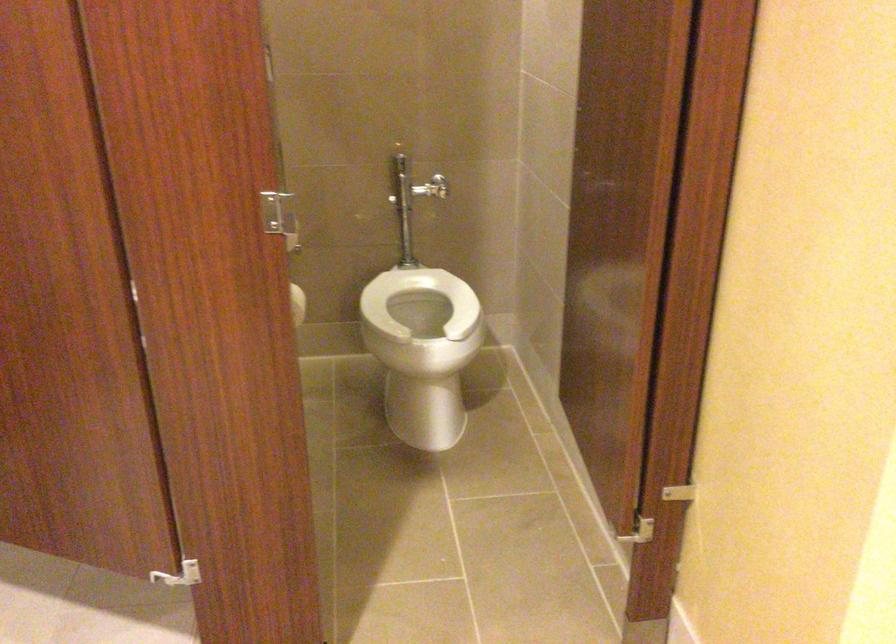
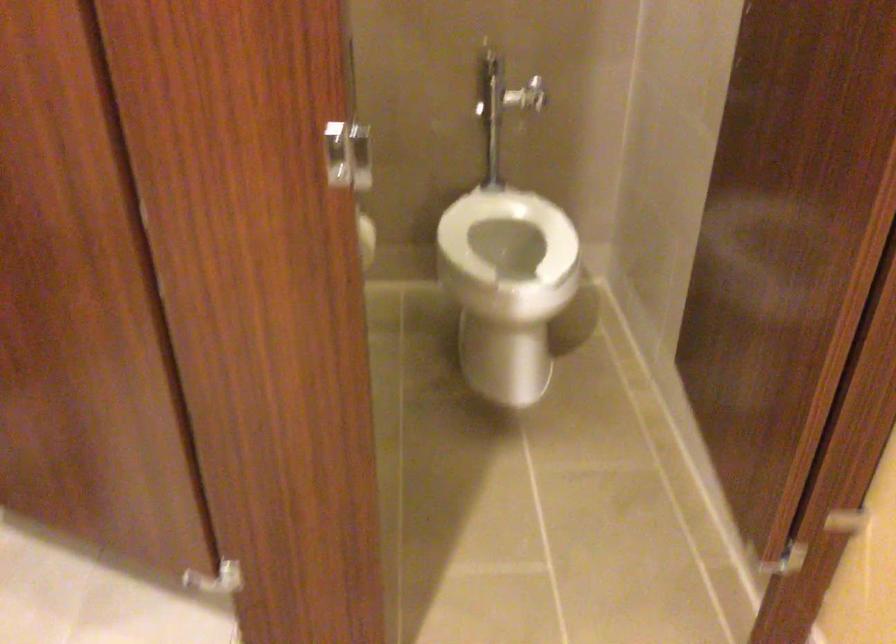
Question: The images are taken continuously from a first-person perspective. In which direction are you moving?

Choices:
 (A) Left
 (B) Right
 (C) Forward
 (D) Backward

Answer: (C)